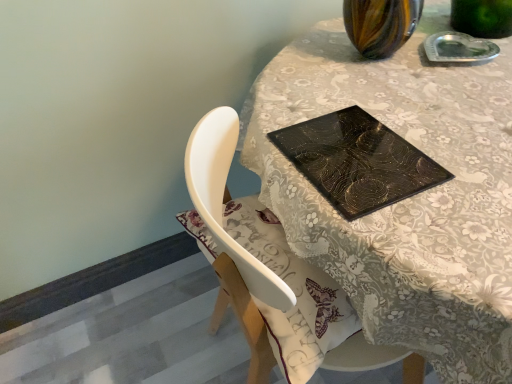
Measure the distance between matte black glass table at center and camera.

The depth of matte black glass table at center is 20.39 inches.

The height and width of the screenshot is (384, 512). I want to click on matte black glass table at center, so click(x=408, y=199).

What do you see at coordinates (408, 199) in the screenshot? I see `matte black glass table at center` at bounding box center [408, 199].

What do you see at coordinates (357, 161) in the screenshot? I see `black glossy placemat at upper center` at bounding box center [357, 161].

Where is `black glossy placemat at upper center`? The height and width of the screenshot is (384, 512). black glossy placemat at upper center is located at coordinates (357, 161).

Measure the distance between point (385, 139) and camera.

Point (385, 139) is 78.70 centimeters from camera.

The image size is (512, 384). Identify the location of matte black glass table at center. (408, 199).

Considering the relative positions of matte black glass table at center and black glossy placemat at upper center in the image provided, is matte black glass table at center to the right of black glossy placemat at upper center from the viewer's perspective?

Yes.

Who is more distant, matte black glass table at center or black glossy placemat at upper center?

black glossy placemat at upper center is behind.

Is point (501, 225) in front of point (411, 186)?

Yes, it is in front of point (411, 186).

From the image's perspective, which is above, matte black glass table at center or black glossy placemat at upper center?

black glossy placemat at upper center appears higher in the image.

From a real-world perspective, which object stands above the other?

black glossy placemat at upper center, from a real-world perspective.

Looking at this image, considering the sizes of objects matte black glass table at center and black glossy placemat at upper center in the image provided, who is thinner, matte black glass table at center or black glossy placemat at upper center?

A: Thinner between the two is black glossy placemat at upper center.

Can you confirm if matte black glass table at center is shorter than black glossy placemat at upper center?

Incorrect, the height of matte black glass table at center does not fall short of that of black glossy placemat at upper center.

In the scene shown: Based on their sizes in the image, would you say matte black glass table at center is bigger or smaller than black glossy placemat at upper center?

Clearly, matte black glass table at center is larger in size than black glossy placemat at upper center.

In the scene shown: Would you say matte black glass table at center is inside or outside black glossy placemat at upper center?

matte black glass table at center is spatially situated outside black glossy placemat at upper center.

Are matte black glass table at center and black glossy placemat at upper center making contact?

There is a gap between matte black glass table at center and black glossy placemat at upper center.

Is matte black glass table at center positioned with its back to black glossy placemat at upper center?

No.

Can you tell me how much matte black glass table at center and black glossy placemat at upper center differ in facing direction?

The angle between the facing direction of matte black glass table at center and the facing direction of black glossy placemat at upper center is 90 degrees.

At what (x,y) coordinates should I click in order to perform the action: click on table below the black glossy placemat at upper center (from the image's perspective). Please return your answer as a coordinate pair (x, y). The width and height of the screenshot is (512, 384). Looking at the image, I should click on (408, 199).

Is black glossy placemat at upper center at the right side of matte black glass table at center?

No, black glossy placemat at upper center is not to the right of matte black glass table at center.

Is black glossy placemat at upper center in front of or behind matte black glass table at center in the image?

Clearly, black glossy placemat at upper center is behind matte black glass table at center.

Which is behind, point (295, 160) or point (429, 15)?

The point (429, 15) is more distant.

From the image's perspective, would you say black glossy placemat at upper center is shown under matte black glass table at center?

No.

From a real-world perspective, is black glossy placemat at upper center under matte black glass table at center?

No, from a real-world perspective, black glossy placemat at upper center is not below matte black glass table at center.

Considering the relative sizes of black glossy placemat at upper center and matte black glass table at center in the image provided, is black glossy placemat at upper center wider than matte black glass table at center?

Incorrect, the width of black glossy placemat at upper center does not surpass that of matte black glass table at center.

In terms of height, does black glossy placemat at upper center look taller or shorter compared to matte black glass table at center?

black glossy placemat at upper center is shorter than matte black glass table at center.

Considering the relative sizes of black glossy placemat at upper center and matte black glass table at center in the image provided, is black glossy placemat at upper center smaller than matte black glass table at center?

Yes, black glossy placemat at upper center is smaller than matte black glass table at center.

Does black glossy placemat at upper center contain matte black glass table at center?

No, matte black glass table at center is not inside black glossy placemat at upper center.

Is black glossy placemat at upper center positioned far away from matte black glass table at center?

That's not correct — black glossy placemat at upper center is a little close to matte black glass table at center.

Is black glossy placemat at upper center positioned with its back to matte black glass table at center?

Correct, black glossy placemat at upper center is looking away from matte black glass table at center.

What's the angular difference between black glossy placemat at upper center and matte black glass table at center's facing directions?

The angle between the facing direction of black glossy placemat at upper center and the facing direction of matte black glass table at center is 90 degrees.

Measure the distance between black glossy placemat at upper center and matte black glass table at center.

A distance of 4.84 inches exists between black glossy placemat at upper center and matte black glass table at center.

Identify the location of book cover located behind the matte black glass table at center. (357, 161).

You are a GUI agent. You are given a task and a screenshot of the screen. Output one action in this format:
    pyautogui.click(x=<x>, y=<y>)
    Task: Click on the book cover above the matte black glass table at center (from the image's perspective)
    The height and width of the screenshot is (384, 512).
    Given the screenshot: What is the action you would take?
    pyautogui.click(x=357, y=161)

Where is `table lying below the black glossy placemat at upper center (from the image's perspective)`? table lying below the black glossy placemat at upper center (from the image's perspective) is located at coordinates (408, 199).